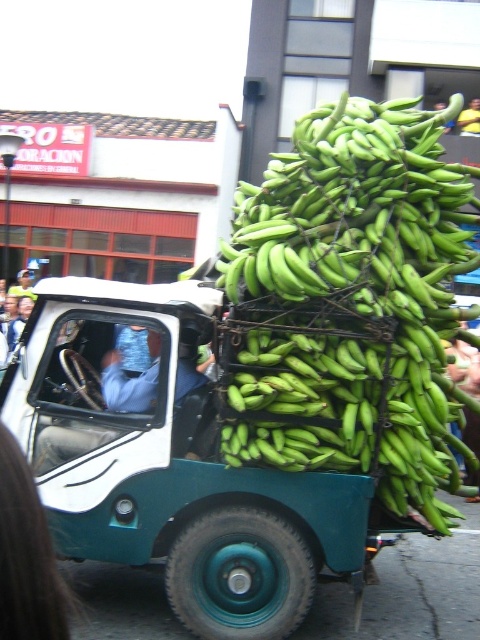
You are a delivery person who needs to know if the green rubber truck at center can fit through a standard garage door that is 2 meters tall. The green matte bananas at center are stacked to a height of 2.5 meters. Can the truck pass through the door without the bananas?

The green rubber truck at center is shorter than the green matte bananas at center. Since the bananas are 2.5 meters tall and the truck is shorter, the truck itself is under 2.5 meters. However, the standard garage door is 2 meters tall. Without the bananas, the truck must be shorter than 2 meters to fit. The description does not specify the truck height, only that it is shorter than the bananas. Therefore, it is uncertain if it can pass through the 2 meter door.

You are a delivery person who needs to check the load on the green rubber truck at center. You see the blue fabric shirt at left of the driver. Which object is positioned lower in the image?

The green rubber truck at center is located below blue fabric shirt at left, so the green rubber truck at center is positioned lower in the image.